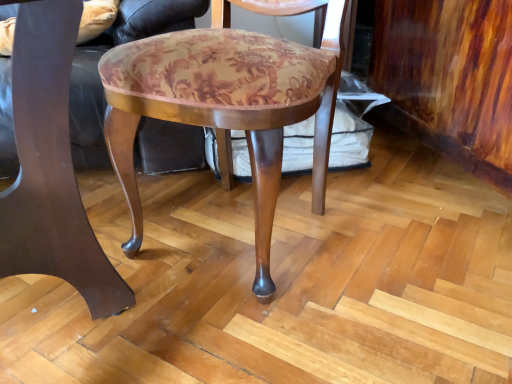
Question: In which direction should I rotate to look at wooden chair at center, the first chair when ordered from right to left?

Choices:
 (A) right
 (B) left

Answer: (B)

Question: Is matte brown wood chair at center, arranged as the 2th chair when viewed from the right, not within wooden chair at center, the first chair when ordered from right to left?

Choices:
 (A) no
 (B) yes

Answer: (B)

Question: Is matte brown wood chair at center, arranged as the 2th chair when viewed from the right, taller than wooden chair at center, marked as the second chair in a left-to-right arrangement?

Choices:
 (A) no
 (B) yes

Answer: (B)

Question: From a real-world perspective, is matte brown wood chair at center, the 1th chair from the left, on top of wooden chair at center, marked as the second chair in a left-to-right arrangement?

Choices:
 (A) no
 (B) yes

Answer: (B)

Question: Can you see matte brown wood chair at center, arranged as the 2th chair when viewed from the right, touching wooden chair at center, the first chair when ordered from right to left?

Choices:
 (A) no
 (B) yes

Answer: (A)

Question: Does matte brown wood chair at center, the 1th chair from the left, turn towards wooden chair at center, marked as the second chair in a left-to-right arrangement?

Choices:
 (A) no
 (B) yes

Answer: (A)

Question: Is matte brown wood chair at center, arranged as the 2th chair when viewed from the right, to the left of wooden chair at center, the first chair when ordered from right to left, from the viewer's perspective?

Choices:
 (A) no
 (B) yes

Answer: (B)

Question: Is wooden chair at center, marked as the second chair in a left-to-right arrangement, wider than matte brown wood chair at center, the 1th chair from the left?

Choices:
 (A) yes
 (B) no

Answer: (B)

Question: Is wooden chair at center, marked as the second chair in a left-to-right arrangement, closer to camera compared to matte brown wood chair at center, arranged as the 2th chair when viewed from the right?

Choices:
 (A) yes
 (B) no

Answer: (B)

Question: Considering the relative sizes of wooden chair at center, the first chair when ordered from right to left, and matte brown wood chair at center, arranged as the 2th chair when viewed from the right, in the image provided, is wooden chair at center, the first chair when ordered from right to left, taller than matte brown wood chair at center, arranged as the 2th chair when viewed from the right,?

Choices:
 (A) yes
 (B) no

Answer: (B)

Question: Is wooden chair at center, the first chair when ordered from right to left, beside matte brown wood chair at center, the 1th chair from the left?

Choices:
 (A) yes
 (B) no

Answer: (B)

Question: Is wooden chair at center, marked as the second chair in a left-to-right arrangement, smaller than matte brown wood chair at center, arranged as the 2th chair when viewed from the right?

Choices:
 (A) yes
 (B) no

Answer: (B)

Question: Is wooden chair at center, the first chair when ordered from right to left, not within matte brown wood chair at center, the 1th chair from the left?

Choices:
 (A) yes
 (B) no

Answer: (A)

Question: From a real-world perspective, is matte brown wood chair at center, arranged as the 2th chair when viewed from the right, positioned above or below wooden chair at center, the first chair when ordered from right to left?

Choices:
 (A) below
 (B) above

Answer: (B)